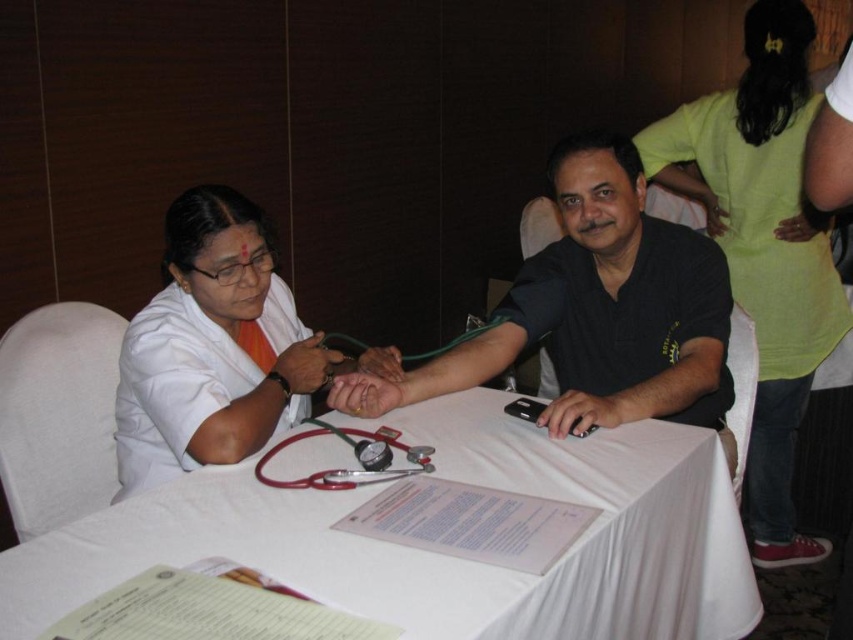
Locate an element on the screen. The image size is (853, 640). white cloth-covered table at center is located at coordinates (438, 554).

Can you confirm if white cloth-covered table at center is wider than red rubber stethoscope at center?

Yes.

Which is in front, point (527, 472) or point (309, 420)?

Point (527, 472)

Locate an element on the screen. The image size is (853, 640). white cloth-covered table at center is located at coordinates (438, 554).

Who is taller, white cloth-covered table at center or black matte shirt at center?

black matte shirt at center is taller.

Is white cloth-covered table at center below black matte shirt at center?

Yes, white cloth-covered table at center is below black matte shirt at center.

Does point (718, 632) lie in front of point (329, 404)?

Yes, point (718, 632) is closer to viewer.

You are a GUI agent. You are given a task and a screenshot of the screen. Output one action in this format:
    pyautogui.click(x=<x>, y=<y>)
    Task: Click on the white cloth-covered table at center
    Image resolution: width=853 pixels, height=640 pixels.
    Given the screenshot: What is the action you would take?
    pyautogui.click(x=438, y=554)

Describe the element at coordinates (598, 310) in the screenshot. I see `black matte shirt at center` at that location.

Is black matte shirt at center shorter than red rubber stethoscope at center?

In fact, black matte shirt at center may be taller than red rubber stethoscope at center.

The image size is (853, 640). Find the location of `black matte shirt at center`. black matte shirt at center is located at coordinates (598, 310).